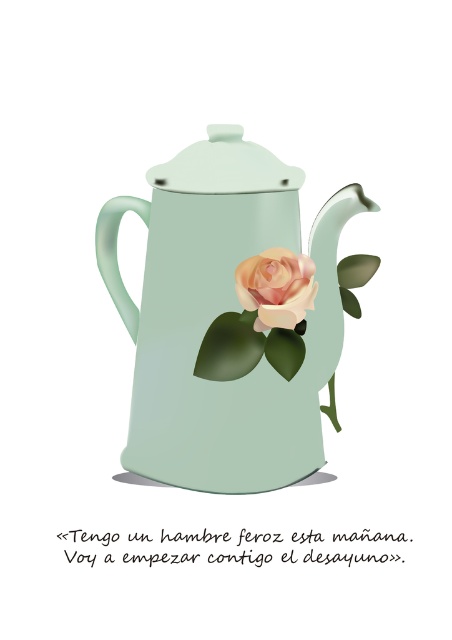
What is located at the coordinates point (229, 317)?

The matte ceramic teapot at center is located at point (229, 317).

You are a tea lover who wants to pour tea from the matte ceramic teapot at center into a cup. However, the matte green lid at upper center is currently blocking the opening. Can you lift the lid to access the inside of the teapot?

The matte ceramic teapot at center is in front of the matte green lid at upper center, meaning the lid is already removed or not properly placed. Therefore, you can access the inside of the matte ceramic teapot at center without needing to lift the lid.

You are an art student analyzing the composition of the image. You notice the matte ceramic teapot at center and the matte green lid at upper center. Based on their positions, which object is placed to the right of the other?

The matte ceramic teapot at center is positioned on the right side of matte green lid at upper center, so the teapot is to the right of the lid.